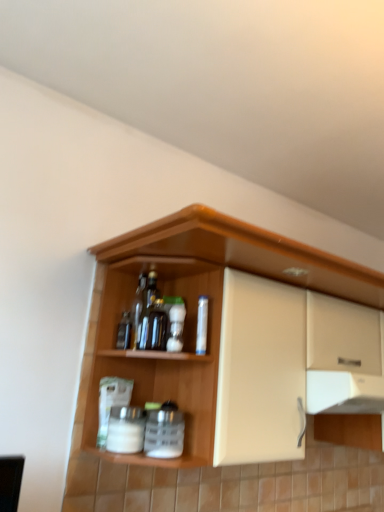
How much space does translucent glass bottle at center, acting as the 2th bottle starting from the right, occupy horizontally?

translucent glass bottle at center, acting as the 2th bottle starting from the right, is 2.52 inches wide.

In order to face translucent glass bottle at center, the 1th bottle viewed from the left, should I rotate leftwards or rightwards?

You should look left and rotate roughly 2.441 degrees.

What do you see at coordinates (126, 429) in the screenshot? I see `white matte jar at lower center, positioned as the second beverage in right-to-left order` at bounding box center [126, 429].

How much space does white matte jar at lower center, positioned as the second beverage in right-to-left order, occupy horizontally?

white matte jar at lower center, positioned as the second beverage in right-to-left order, is 9.71 centimeters wide.

In order to click on wooden cabinet at upper center in this screenshot , I will do `click(216, 270)`.

Image resolution: width=384 pixels, height=512 pixels. Describe the element at coordinates (202, 325) in the screenshot. I see `clear plastic bottle at center, the 2th bottle viewed from the left` at that location.

The height and width of the screenshot is (512, 384). In order to click on translucent glass bottle at center, the 1th bottle viewed from the left in this screenshot , I will do `click(175, 323)`.

Considering the points (197, 354) and (380, 285), which point is in front, point (197, 354) or point (380, 285)?

The point (197, 354) is more forward.

Which object is more forward, clear plastic bottle at center, the 1th bottle from the right, or wooden cabinet at upper center?

wooden cabinet at upper center is closer to the camera.

Is white plastic spice container at center, which is the 1th beverage in right-to-left order, aimed at wooden cabinet at upper center?

Yes, white plastic spice container at center, which is the 1th beverage in right-to-left order, is turned towards wooden cabinet at upper center.

What's the angular difference between white plastic spice container at center, which is the 1th beverage in right-to-left order, and wooden cabinet at upper center's facing directions?

3.78 degrees.

Which is more to the right, white plastic spice container at center, which is the 1th beverage in right-to-left order, or wooden cabinet at upper center?

wooden cabinet at upper center is more to the right.

Is white plastic spice container at center, which is the 1th beverage in right-to-left order, further to the viewer compared to wooden cabinet at upper center?

Yes, the depth of white plastic spice container at center, which is the 1th beverage in right-to-left order, is greater than that of wooden cabinet at upper center.

Looking at their sizes, would you say wooden cabinet at upper center is wider or thinner than white plastic spice container at center, which is the second beverage in left-to-right order?

Clearly, wooden cabinet at upper center has more width compared to white plastic spice container at center, which is the second beverage in left-to-right order.

Is wooden cabinet at upper center far away from white plastic spice container at center, which is the 1th beverage in right-to-left order?

wooden cabinet at upper center is near white plastic spice container at center, which is the 1th beverage in right-to-left order, not far away.

Consider the image. How many degrees apart are the facing directions of wooden cabinet at upper center and white plastic spice container at center, which is the 1th beverage in right-to-left order?

The angle between the facing direction of wooden cabinet at upper center and the facing direction of white plastic spice container at center, which is the 1th beverage in right-to-left order, is 3.78 degrees.

Which object is closer to the camera taking this photo, wooden cabinet at upper center or white plastic spice container at center, which is the 1th beverage in right-to-left order?

wooden cabinet at upper center.

Between white matte jar at lower center, positioned as the second beverage in right-to-left order, and wooden cabinet at upper center, which one has smaller width?

Thinner between the two is white matte jar at lower center, positioned as the second beverage in right-to-left order.

Consider the image. From the image's perspective, is white matte jar at lower center, positioned as the second beverage in right-to-left order, under wooden cabinet at upper center?

Indeed, from the image's perspective, white matte jar at lower center, positioned as the second beverage in right-to-left order, is shown beneath wooden cabinet at upper center.

Considering the points (127, 426) and (120, 466), which point is behind, point (127, 426) or point (120, 466)?

Point (120, 466)

Considering the sizes of translucent glass bottle at center, acting as the 2th bottle starting from the right, and clear plastic bottle at center, the 1th bottle from the right, in the image, is translucent glass bottle at center, acting as the 2th bottle starting from the right, bigger or smaller than clear plastic bottle at center, the 1th bottle from the right,?

Considering their sizes, translucent glass bottle at center, acting as the 2th bottle starting from the right, takes up more space than clear plastic bottle at center, the 1th bottle from the right.

Is translucent glass bottle at center, acting as the 2th bottle starting from the right, positioned far away from clear plastic bottle at center, the 2th bottle viewed from the left?

That's not correct — translucent glass bottle at center, acting as the 2th bottle starting from the right, is a little close to clear plastic bottle at center, the 2th bottle viewed from the left.

Is translucent glass bottle at center, acting as the 2th bottle starting from the right, facing towards clear plastic bottle at center, the 1th bottle from the right?

No, translucent glass bottle at center, acting as the 2th bottle starting from the right, is not turned towards clear plastic bottle at center, the 1th bottle from the right.

From the image's perspective, is translucent glass bottle at center, the 1th bottle viewed from the left, above or below clear plastic bottle at center, the 1th bottle from the right?

Based on their image positions, translucent glass bottle at center, the 1th bottle viewed from the left, is located beneath clear plastic bottle at center, the 1th bottle from the right.

Is clear plastic bottle at center, the 2th bottle viewed from the left, completely or partially inside white plastic spice container at center, which is the second beverage in left-to-right order?

No.

Which is further, (161, 447) or (198, 301)?

Positioned behind is point (198, 301).

Is white plastic spice container at center, which is the 1th beverage in right-to-left order, far away from clear plastic bottle at center, the 2th bottle viewed from the left?

white plastic spice container at center, which is the 1th beverage in right-to-left order, is near clear plastic bottle at center, the 2th bottle viewed from the left, not far away.

Would you say translucent glass bottle at center, acting as the 2th bottle starting from the right, is part of white matte jar at lower center, arranged as the first beverage when viewed from the left,'s contents?

No, translucent glass bottle at center, acting as the 2th bottle starting from the right, is not surrounded by white matte jar at lower center, arranged as the first beverage when viewed from the left.

Does white matte jar at lower center, arranged as the first beverage when viewed from the left, turn towards translucent glass bottle at center, the 1th bottle viewed from the left?

No.

Looking at this image, is white matte jar at lower center, positioned as the second beverage in right-to-left order, wider than translucent glass bottle at center, the 1th bottle viewed from the left?

Yes.

From the image's perspective, would you say white matte jar at lower center, arranged as the first beverage when viewed from the left, is positioned over translucent glass bottle at center, the 1th bottle viewed from the left?

No, from the image's perspective, white matte jar at lower center, arranged as the first beverage when viewed from the left, is not over translucent glass bottle at center, the 1th bottle viewed from the left.

Locate an element on the screen. The image size is (384, 512). the 1st bottle behind the wooden cabinet at upper center, counting from the anchor's position is located at coordinates (202, 325).

Where is `cupboard located in front of the white plastic spice container at center, which is the 1th beverage in right-to-left order`? cupboard located in front of the white plastic spice container at center, which is the 1th beverage in right-to-left order is located at coordinates (216, 270).

Estimate the real-world distances between objects in this image. Which object is further from white matte jar at lower center, arranged as the first beverage when viewed from the left, white plastic spice container at center, which is the 1th beverage in right-to-left order, or clear plastic bottle at center, the 2th bottle viewed from the left?

The object further to white matte jar at lower center, arranged as the first beverage when viewed from the left, is clear plastic bottle at center, the 2th bottle viewed from the left.

Estimate the real-world distances between objects in this image. Which object is closer to wooden cabinet at upper center, translucent glass bottle at center, acting as the 2th bottle starting from the right, or white matte jar at lower center, arranged as the first beverage when viewed from the left?

white matte jar at lower center, arranged as the first beverage when viewed from the left, lies closer to wooden cabinet at upper center than the other object.

From the image, which object appears to be farther from clear plastic bottle at center, the 2th bottle viewed from the left, translucent glass bottle at center, the 1th bottle viewed from the left, or white matte jar at lower center, arranged as the first beverage when viewed from the left?

white matte jar at lower center, arranged as the first beverage when viewed from the left, is further to clear plastic bottle at center, the 2th bottle viewed from the left.

Estimate the real-world distances between objects in this image. Which object is closer to white plastic spice container at center, which is the 1th beverage in right-to-left order, translucent glass bottle at center, the 1th bottle viewed from the left, or wooden cabinet at upper center?

The object closer to white plastic spice container at center, which is the 1th beverage in right-to-left order, is translucent glass bottle at center, the 1th bottle viewed from the left.

Based on their spatial positions, is wooden cabinet at upper center or white plastic spice container at center, which is the second beverage in left-to-right order, further from white matte jar at lower center, arranged as the first beverage when viewed from the left?

wooden cabinet at upper center is positioned further to the anchor white matte jar at lower center, arranged as the first beverage when viewed from the left.

Considering their positions, is wooden cabinet at upper center positioned further to white plastic spice container at center, which is the second beverage in left-to-right order, than translucent glass bottle at center, acting as the 2th bottle starting from the right?

The object further to white plastic spice container at center, which is the second beverage in left-to-right order, is wooden cabinet at upper center.

From the image, which object appears to be farther from translucent glass bottle at center, acting as the 2th bottle starting from the right, white plastic spice container at center, which is the second beverage in left-to-right order, or wooden cabinet at upper center?

wooden cabinet at upper center is further to translucent glass bottle at center, acting as the 2th bottle starting from the right.

When comparing their distances from white matte jar at lower center, arranged as the first beverage when viewed from the left, does white plastic spice container at center, which is the second beverage in left-to-right order, or wooden cabinet at upper center seem further?

The object further to white matte jar at lower center, arranged as the first beverage when viewed from the left, is wooden cabinet at upper center.

The height and width of the screenshot is (512, 384). What are the coordinates of `bottle that lies between clear plastic bottle at center, the 1th bottle from the right, and white matte jar at lower center, positioned as the second beverage in right-to-left order, from top to bottom` in the screenshot? It's located at (175, 323).

In order to click on bottle between translucent glass bottle at center, acting as the 2th bottle starting from the right, and wooden cabinet at upper center, in the horizontal direction in this screenshot , I will do 202,325.

At what (x,y) coordinates should I click in order to perform the action: click on beverage between translucent glass bottle at center, the 1th bottle viewed from the left, and white plastic spice container at center, which is the 1th beverage in right-to-left order, in the vertical direction. Please return your answer as a coordinate pair (x, y). Looking at the image, I should click on (126, 429).

This screenshot has height=512, width=384. In order to click on bottle between clear plastic bottle at center, the 1th bottle from the right, and white plastic spice container at center, which is the second beverage in left-to-right order, in the vertical direction in this screenshot , I will do `click(175, 323)`.